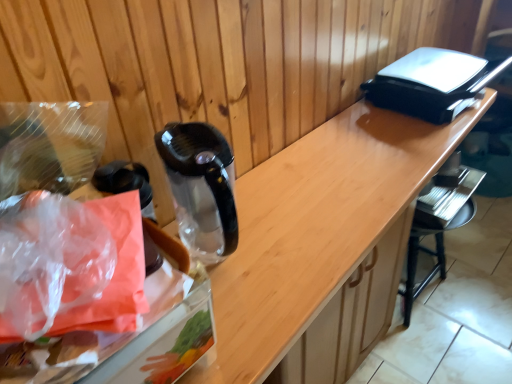
Find the location of `vacant space to the right of transparent plastic bag at left`. vacant space to the right of transparent plastic bag at left is located at coordinates (245, 262).